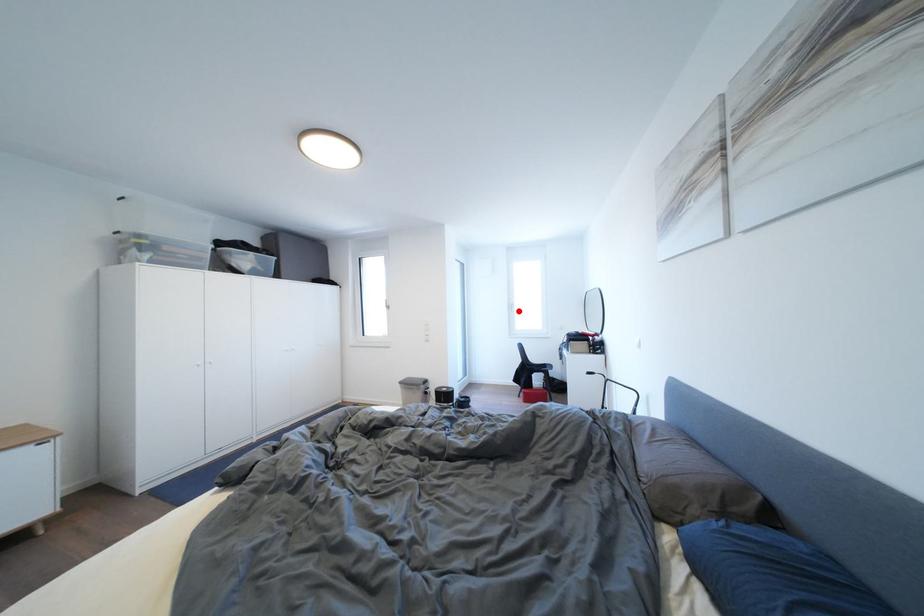
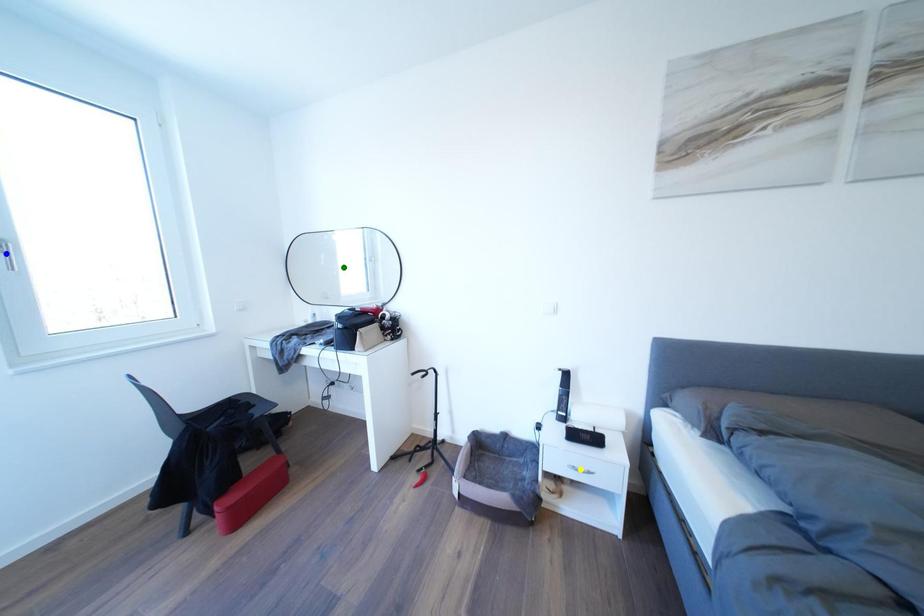
Question: I am providing you with two images of the same scene from different viewpoints. A red point is marked on the first image. You are given multiple points on the second image. Can you choose the point in image 2 that corresponds to the point in image 1?

Choices:
 (A) blue point
 (B) yellow point
 (C) green point

Answer: (A)